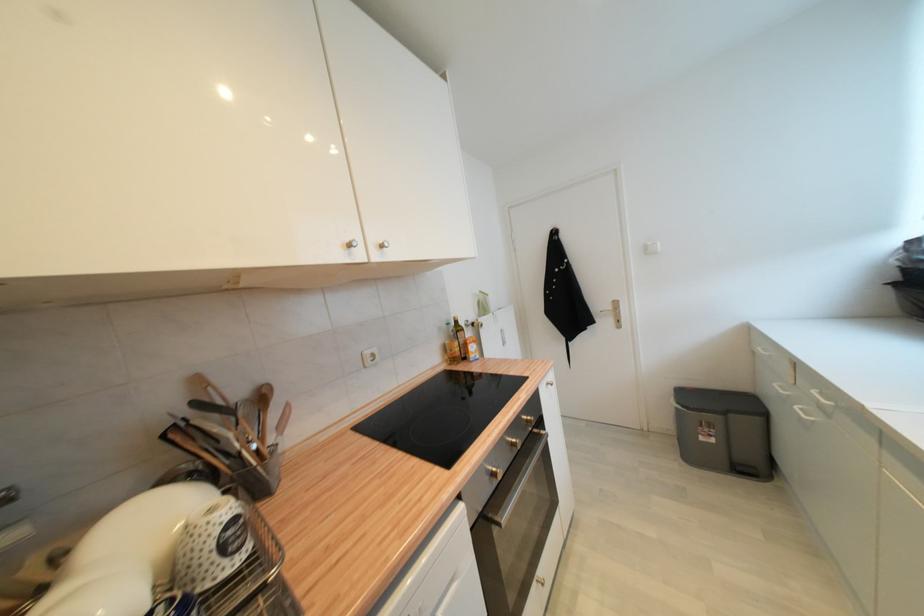
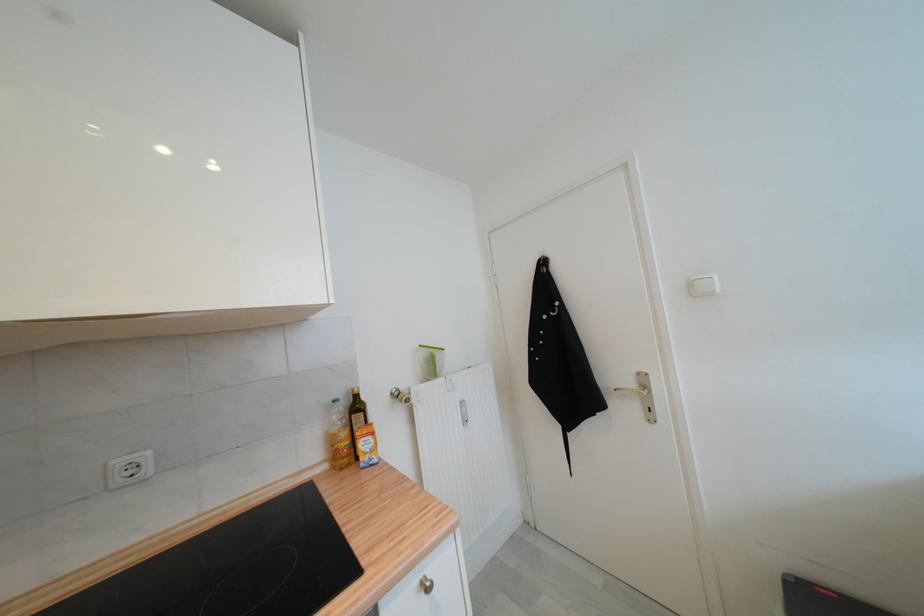
Find the pixel in the second image that matches point (372, 354) in the first image.

(126, 464)